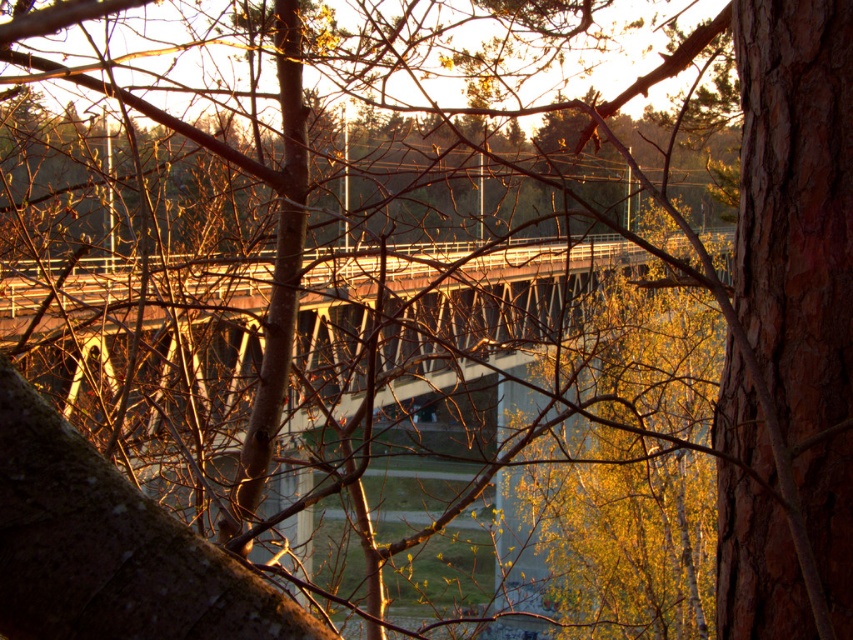
Is rusty metal bridge at center further to the viewer compared to brown rough bark at center right?

Yes, it is.

Who is positioned more to the right, rusty metal bridge at center or brown rough bark at center right?

brown rough bark at center right is more to the right.

Who is more distant from viewer, (51, 288) or (735, 568)?

The point (51, 288) is behind.

Where is `rusty metal bridge at center`? rusty metal bridge at center is located at coordinates (434, 316).